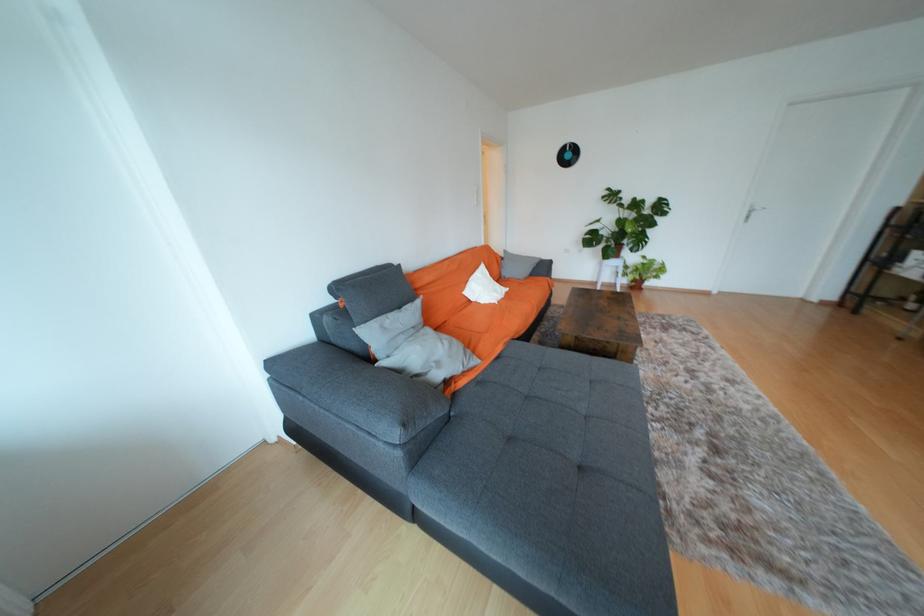
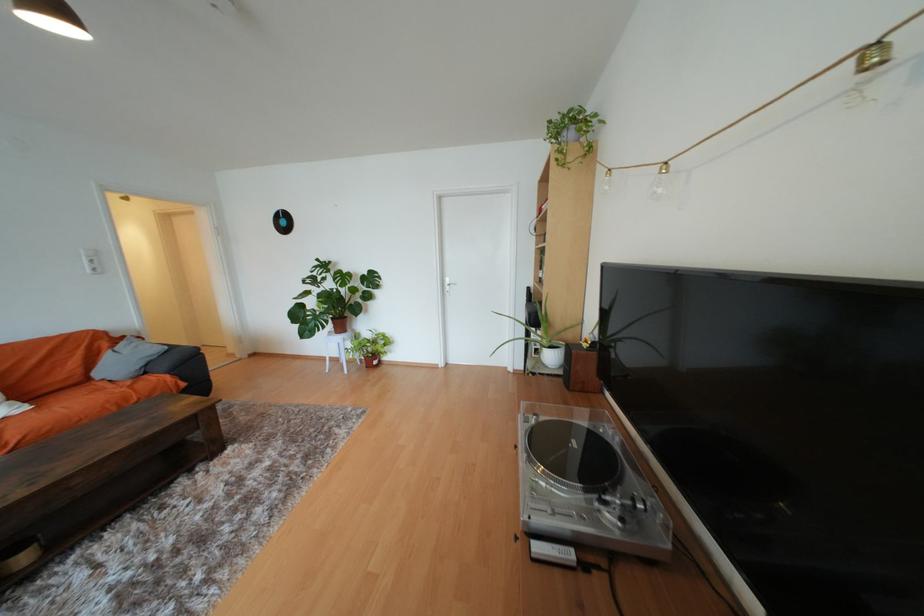
Question: The images are taken continuously from a first-person perspective. In which direction are you moving?

Choices:
 (A) Left
 (B) Right
 (C) Forward
 (D) Backward

Answer: (B)